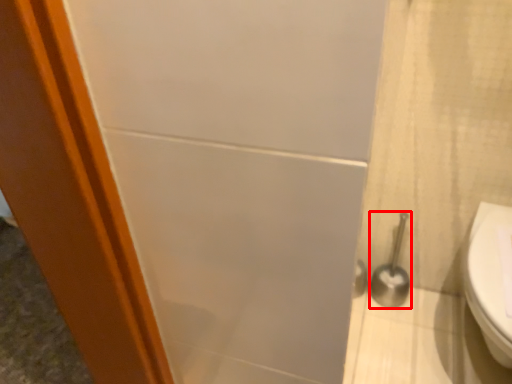
Question: Considering the relative positions of shower (annotated by the red box) and toilet in the image provided, where is shower (annotated by the red box) located with respect to the staircase?

Choices:
 (A) left
 (B) right

Answer: (A)